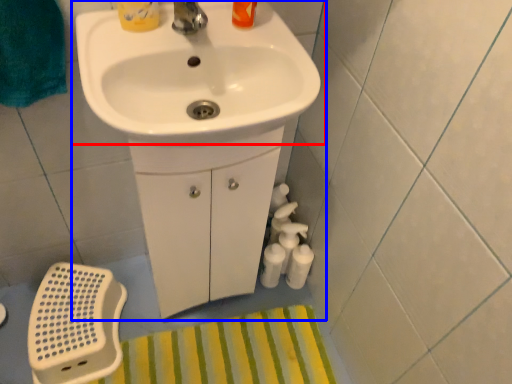
Question: Which point is further to the camera, sink (highlighted by a red box) or sink (highlighted by a blue box)?

Choices:
 (A) sink
 (B) sink

Answer: (B)